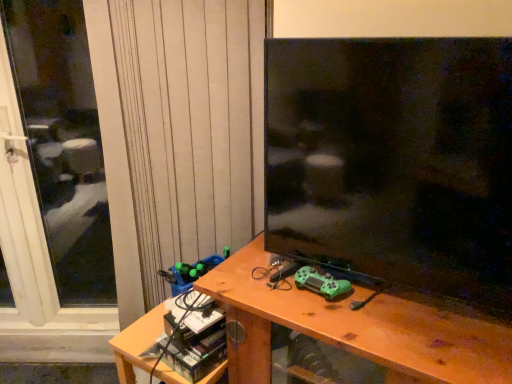
The image size is (512, 384). In order to click on vacant space in front of matte black tv at center in this screenshot , I will do `click(403, 326)`.